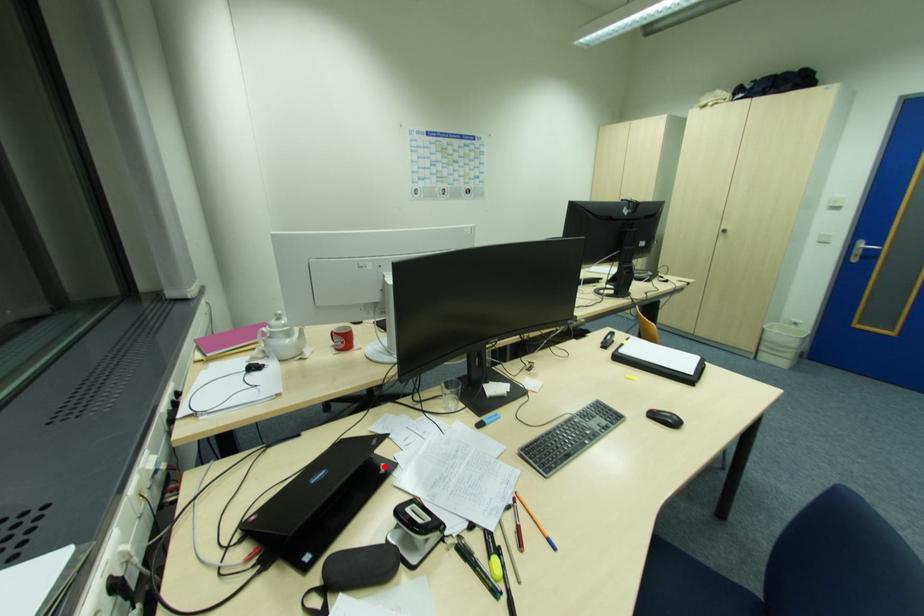
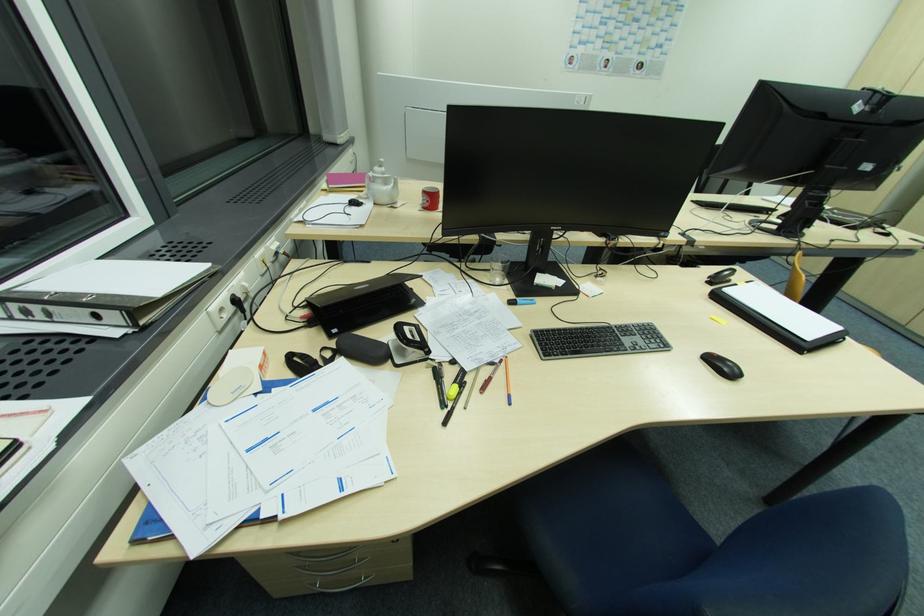
Locate, in the second image, the point that corresponds to the highlighted location in the first image.

(416, 302)